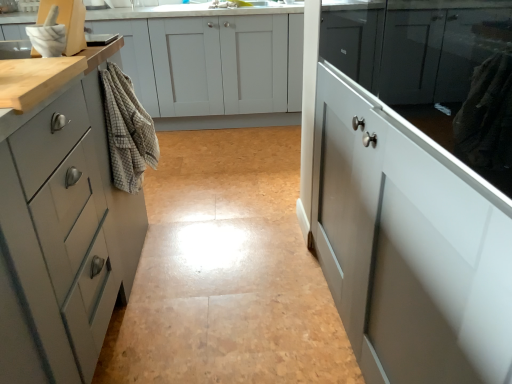
This screenshot has height=384, width=512. Identify the location of free region under beige checkered towel at left (from a real-world perspective). (158, 244).